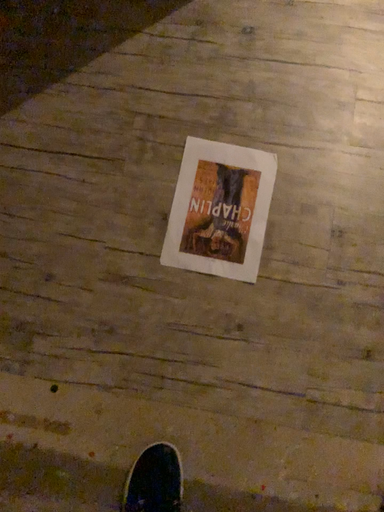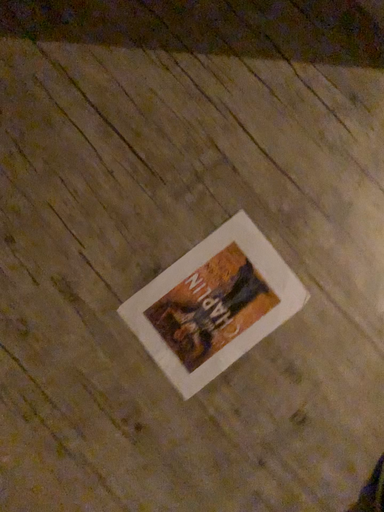
Question: Which way did the camera rotate in the video?

Choices:
 (A) rotated upward
 (B) rotated downward

Answer: (B)